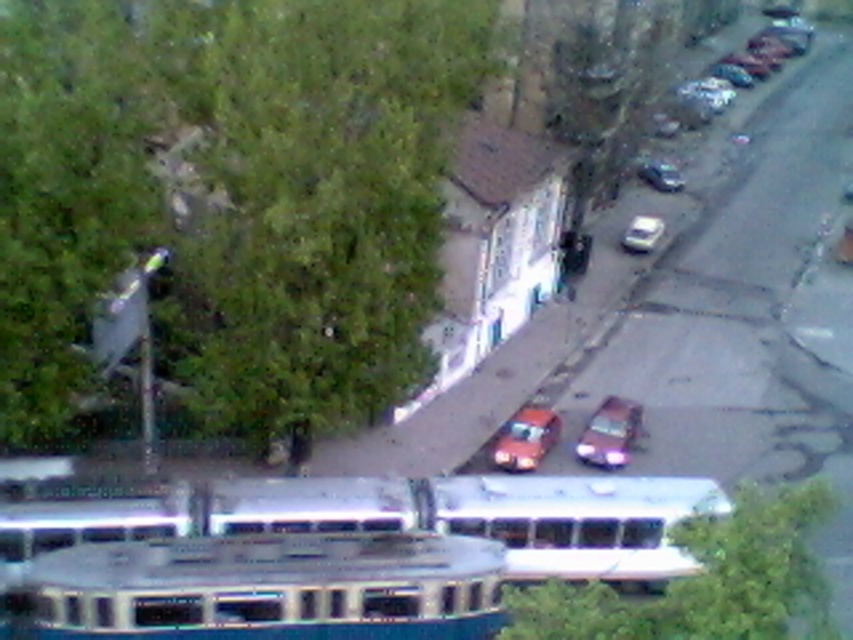
Based on the photo, you are a pedestrian standing on the sidewalk and want to cross the street to reach the building with a light colored facade. There is a metallic silver bus at lower left and a shiny orange car at center blocking your path. Which vehicle should you move around to safely reach the building?

You should move around the metallic silver bus at lower left because it is in front of the shiny orange car at center, so moving around the front vehicle will allow you to access the area behind both and reach the building.

You are standing on the balcony and want to take a photo of both the metallic silver bus at center and the shiny silver sedan at upper right. Which object should you zoom in on first to ensure both are in frame?

You should zoom in on the metallic silver bus at center first because it is closer to you than the shiny silver sedan at upper right, so adjusting the zoom to include the closer bus will help frame both objects.